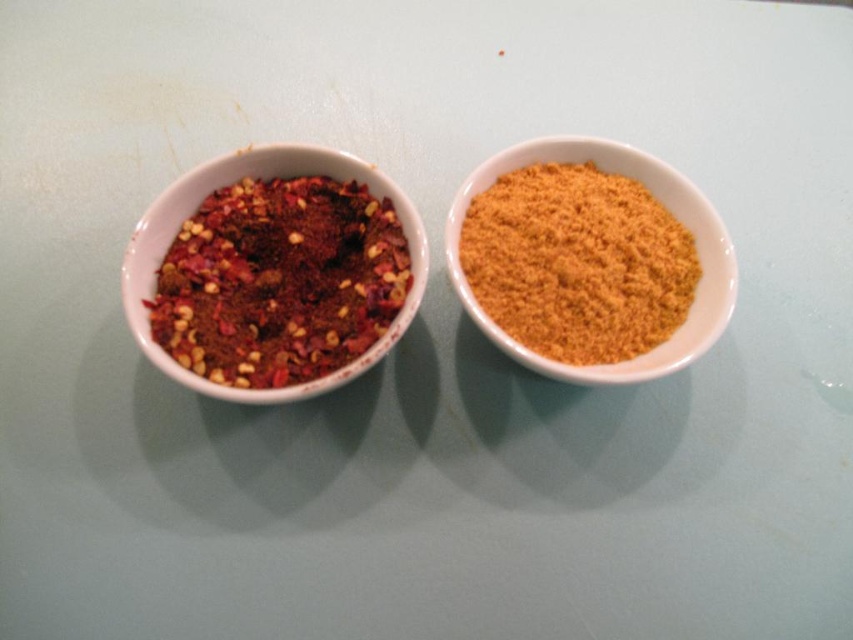
Locate an element on the screen. crumbly red spice mix at left is located at coordinates (279, 282).

Between point (288, 182) and point (593, 360), which one is positioned in front?

Point (593, 360)

Does point (310, 266) lie behind point (611, 220)?

No, it is in front of (611, 220).

Find the location of `crumbly red spice mix at left`. crumbly red spice mix at left is located at coordinates (279, 282).